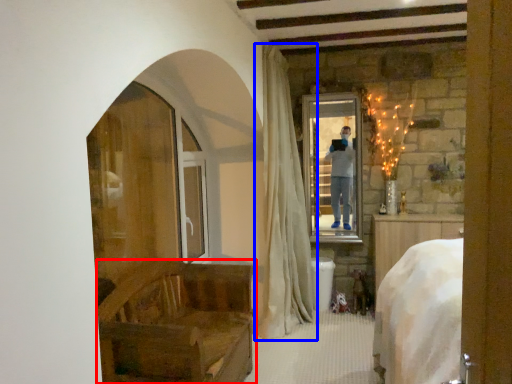
Question: Among these objects, which one is farthest to the camera, furniture (highlighted by a red box) or curtain (highlighted by a blue box)?

Choices:
 (A) furniture
 (B) curtain

Answer: (B)